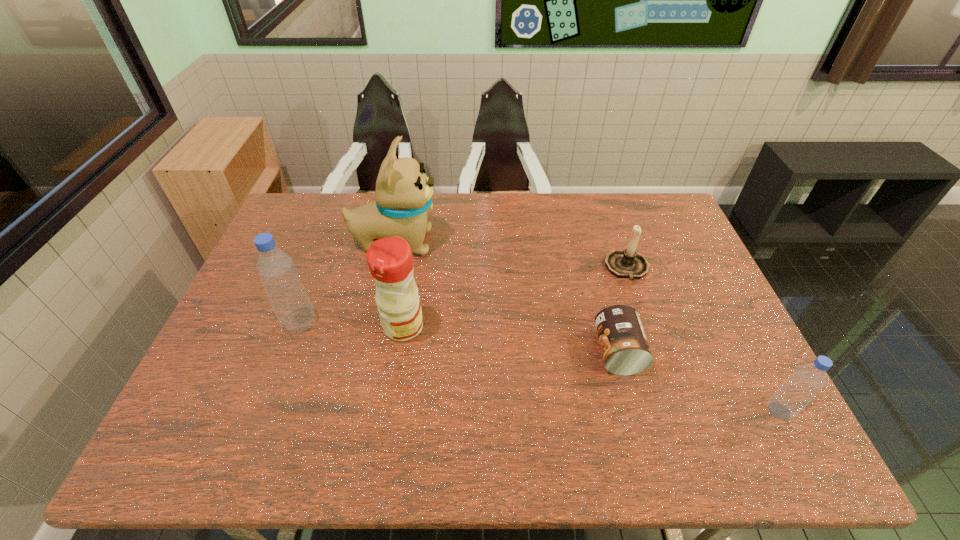
Locate an element on the screen. the left bottle is located at coordinates (276, 269).

This screenshot has height=540, width=960. I want to click on the leftmost object, so click(x=276, y=269).

In order to click on the fourth tallest object in this screenshot , I will do `click(807, 380)`.

This screenshot has height=540, width=960. I want to click on the nearer bottle, so click(x=807, y=380).

Where is `puppy`? The width and height of the screenshot is (960, 540). puppy is located at coordinates (403, 195).

Where is `the fifth tallest object`? the fifth tallest object is located at coordinates (628, 263).

In order to click on condiment in this screenshot , I will do `click(390, 260)`.

The width and height of the screenshot is (960, 540). I want to click on the shortest object, so click(625, 349).

At what (x,y) coordinates should I click in order to perform the action: click on vacant space located on the right of the leftmost object. Please return your answer as a coordinate pair (x, y). Looking at the image, I should click on (342, 323).

I want to click on vacant space located on the back of the right bottle, so click(745, 345).